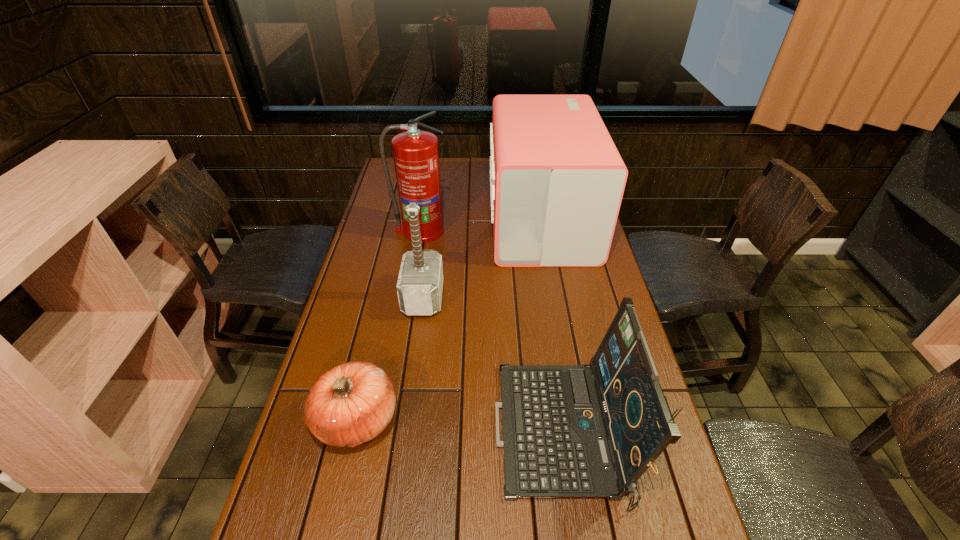
Where is `blank region between the tallest object and the laptop computer`? The height and width of the screenshot is (540, 960). blank region between the tallest object and the laptop computer is located at coordinates (492, 332).

Select which object is the third closest to the second shortest object. Please provide its 2D coordinates. Your answer should be formatted as a tuple, i.e. [(x, y)], where the tuple contains the x and y coordinates of a point satisfying the conditions above.

[(557, 180)]

This screenshot has width=960, height=540. Identify the location of object that ranks as the third closest to the laptop computer. (557, 180).

You are a GUI agent. You are given a task and a screenshot of the screen. Output one action in this format:
    pyautogui.click(x=<x>, y=<y>)
    Task: Click on the free space that satisfies the following two spatial constraints: 1. on the surface of the box where the text is embossed; 2. on the instruction side of the tallest object
    The width and height of the screenshot is (960, 540).
    Given the screenshot: What is the action you would take?
    pyautogui.click(x=543, y=231)